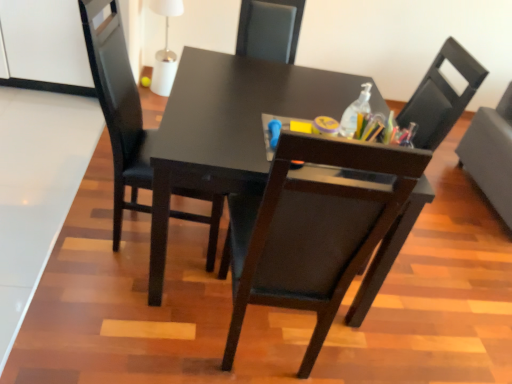
Question: From a real-world perspective, does clear plastic bottle at upper right sit lower than matte black chair at center, marked as the 2th chair in a right-to-left arrangement?

Choices:
 (A) yes
 (B) no

Answer: (B)

Question: Would you say clear plastic bottle at upper right is a long distance from matte black chair at center, marked as the 2th chair in a right-to-left arrangement?

Choices:
 (A) yes
 (B) no

Answer: (B)

Question: From the image's perspective, does clear plastic bottle at upper right appear lower than matte black chair at center, marked as the 2th chair in a right-to-left arrangement?

Choices:
 (A) no
 (B) yes

Answer: (A)

Question: Does clear plastic bottle at upper right appear on the left side of matte black chair at center, marked as the 2th chair in a right-to-left arrangement?

Choices:
 (A) yes
 (B) no

Answer: (B)

Question: Does clear plastic bottle at upper right turn towards matte black chair at center, marked as the 2th chair in a right-to-left arrangement?

Choices:
 (A) no
 (B) yes

Answer: (A)

Question: Based on their sizes in the image, would you say clear plastic bottle at upper right is bigger or smaller than matte black chair at center, marked as the 2th chair in a right-to-left arrangement?

Choices:
 (A) big
 (B) small

Answer: (B)

Question: Considering the positions of point (369, 92) and point (360, 322), is point (369, 92) closer or farther from the camera than point (360, 322)?

Choices:
 (A) farther
 (B) closer

Answer: (A)

Question: Is clear plastic bottle at upper right taller or shorter than matte black chair at center, marked as the 2th chair in a right-to-left arrangement?

Choices:
 (A) short
 (B) tall

Answer: (A)

Question: Which is correct: clear plastic bottle at upper right is inside matte black chair at center, the second chair from the left, or outside of it?

Choices:
 (A) inside
 (B) outside

Answer: (B)

Question: From the image's perspective, relative to matte black chair at center, which ranks as the third chair in right-to-left order, is black matte chair at right, acting as the 3th chair starting from the left, above or below?

Choices:
 (A) below
 (B) above

Answer: (B)

Question: Does point (508, 162) appear closer or farther from the camera than point (102, 92)?

Choices:
 (A) farther
 (B) closer

Answer: (A)

Question: Visually, is black matte chair at right, the 1th chair when ordered from right to left, positioned to the left or to the right of matte black chair at center, the first chair in the left-to-right sequence?

Choices:
 (A) left
 (B) right

Answer: (B)

Question: Choose the correct answer: Is black matte chair at right, acting as the 3th chair starting from the left, inside matte black chair at center, which ranks as the third chair in right-to-left order, or outside it?

Choices:
 (A) inside
 (B) outside

Answer: (B)

Question: Would you say matte black chair at center, the second chair from the left, is to the left or to the right of black matte chair at right, the 1th chair when ordered from right to left, in the picture?

Choices:
 (A) right
 (B) left

Answer: (B)

Question: Considering the positions of matte black chair at center, the second chair from the left, and black matte chair at right, the 1th chair when ordered from right to left, in the image, is matte black chair at center, the second chair from the left, bigger or smaller than black matte chair at right, the 1th chair when ordered from right to left,?

Choices:
 (A) small
 (B) big

Answer: (A)